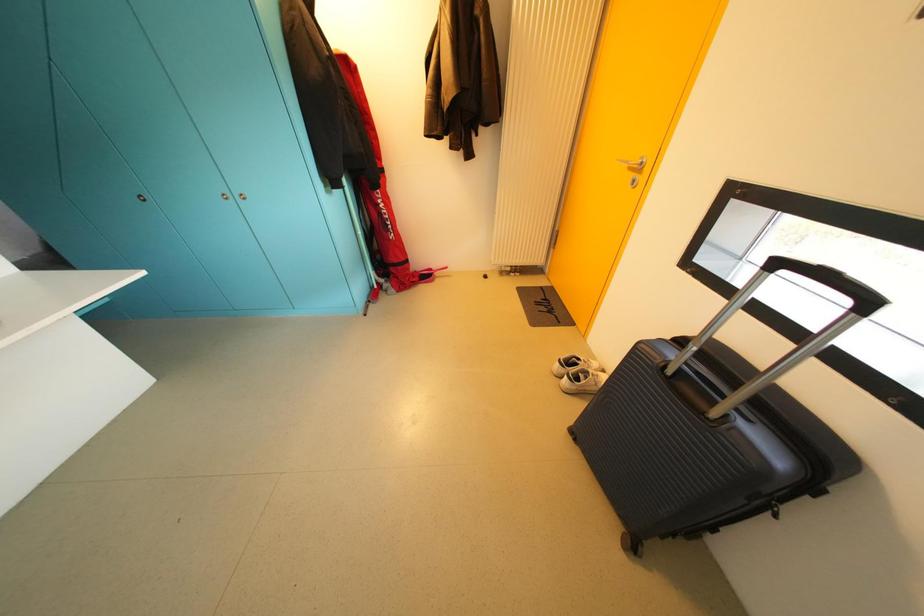
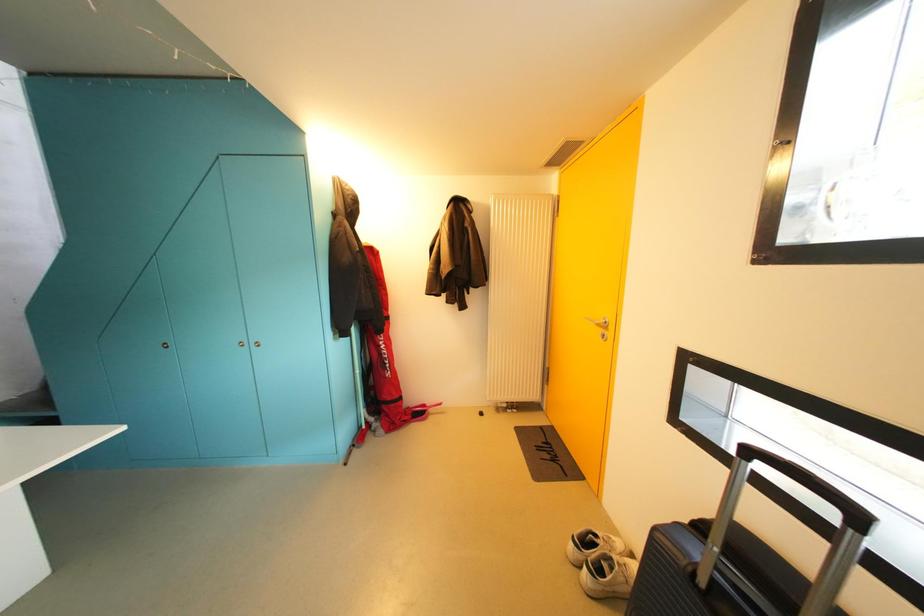
Question: The first image is from the beginning of the video and the second image is from the end. How did the camera likely rotate when shooting the video?

Choices:
 (A) Left
 (B) Right
 (C) Up
 (D) Down

Answer: (C)